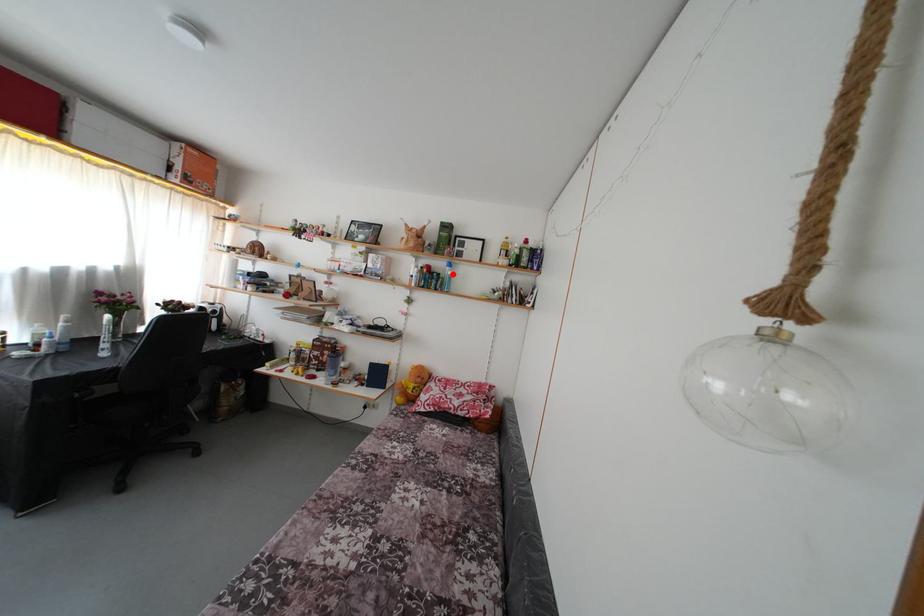
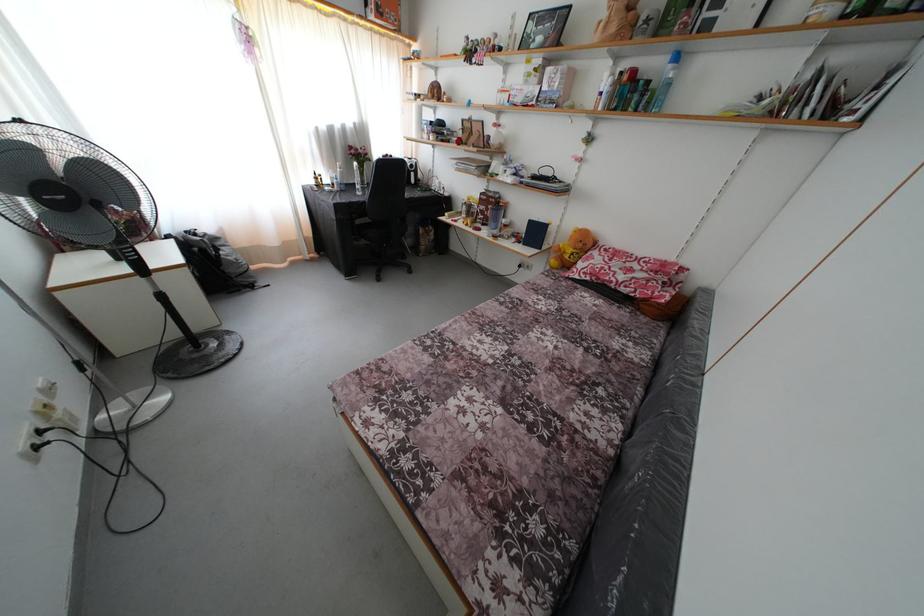
Locate, in the second image, the point that corresponds to the highlighted location in the first image.

(675, 73)